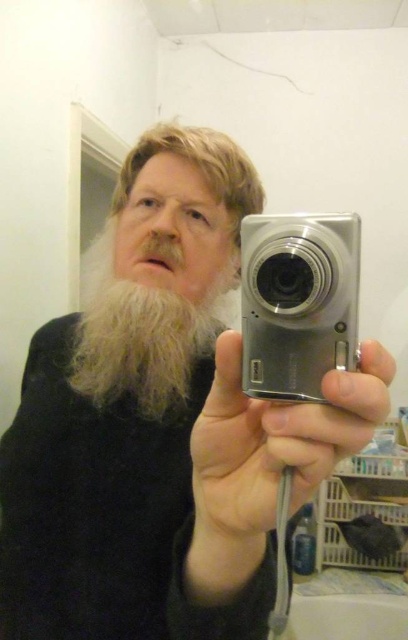
You are a photographer trying to capture a detailed closeup of the person in the bathroom scene. You notice two points marked in the image at coordinates point (277,381) and point (99,392). Which point should you focus on to ensure the subject is in sharp focus?

You should focus on point (277,381) because it is closer to the camera than point (99,392), ensuring the subject will be in sharp focus.

What object is located at the coordinates point (297, 301) in the image?

The point (297, 301) indicates the silver metallic camera at center.

You are a photographer trying to place the silver metallic camera at center and the light brown fuzzy beard at center into a narrow display case. The case can only accommodate items that are less than 3 inches thick. Which item might not fit based on their thickness?

The light brown fuzzy beard at center is thicker than the silver metallic camera at center, so it might not fit in the display case since it exceeds the 3 inches thickness limit.